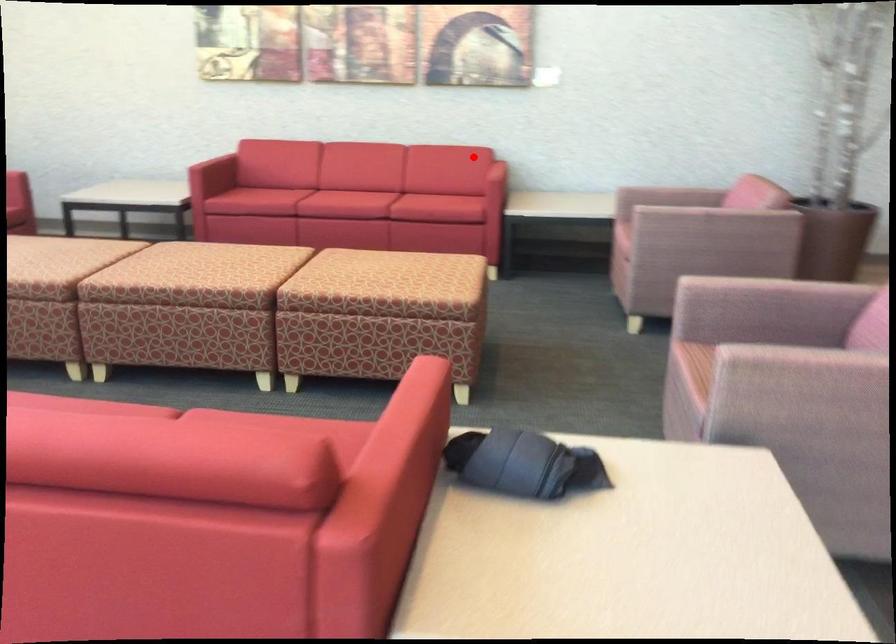
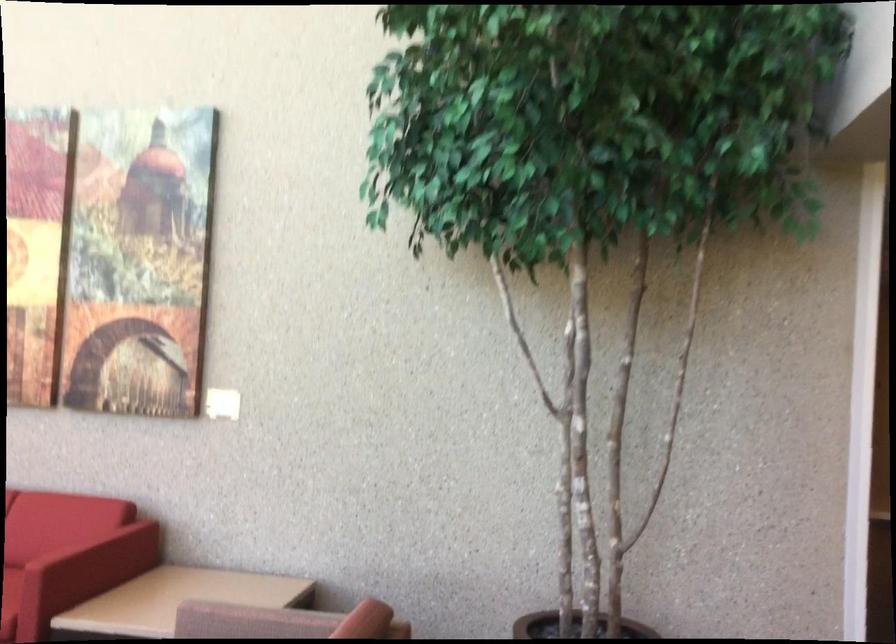
In the second image, find the point that corresponds to the highlighted location in the first image.

(80, 540)